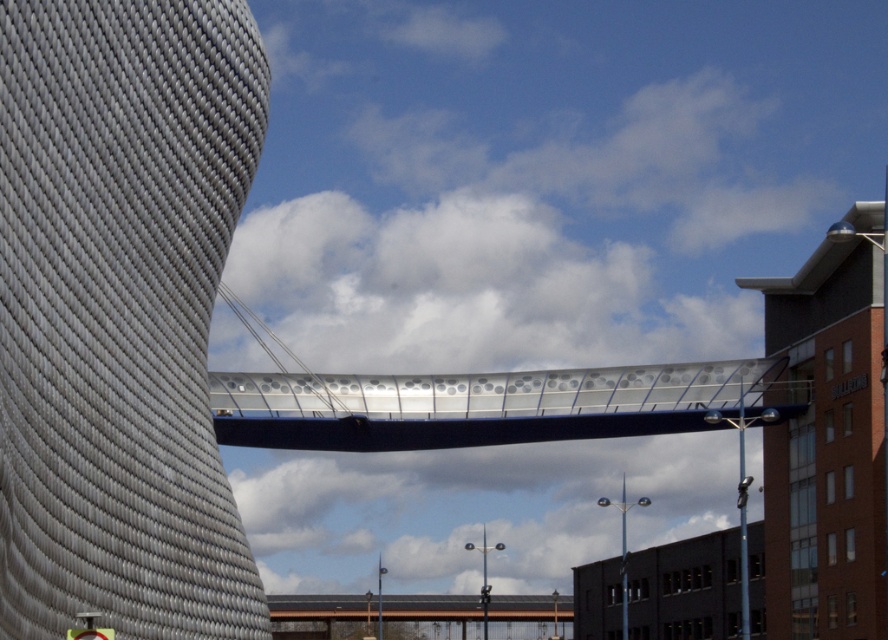
What do you see at coordinates (120, 312) in the screenshot? I see `textured gray tower at center` at bounding box center [120, 312].

Based on the photo, does textured gray tower at center have a lesser height compared to brick building at right?

Correct, textured gray tower at center is not as tall as brick building at right.

This screenshot has width=888, height=640. Identify the location of textured gray tower at center. (120, 312).

Is textured gray tower at center bigger than metallic gray pedestrian bridge at center?

No.

Which is in front, point (181, 385) or point (387, 604)?

Positioned in front is point (181, 385).

Where is `textured gray tower at center`? textured gray tower at center is located at coordinates (120, 312).

Between point (830, 358) and point (400, 605), which one is positioned in front?

Positioned in front is point (830, 358).

Does brick building at right appear over metallic gray pedestrian bridge at center?

Indeed, brick building at right is positioned over metallic gray pedestrian bridge at center.

Is point (881, 592) farther from camera compared to point (453, 612)?

No, (881, 592) is in front of (453, 612).

At what (x,y) coordinates should I click in order to perform the action: click on brick building at right. Please return your answer as a coordinate pair (x, y). This screenshot has width=888, height=640. Looking at the image, I should click on point(829,438).